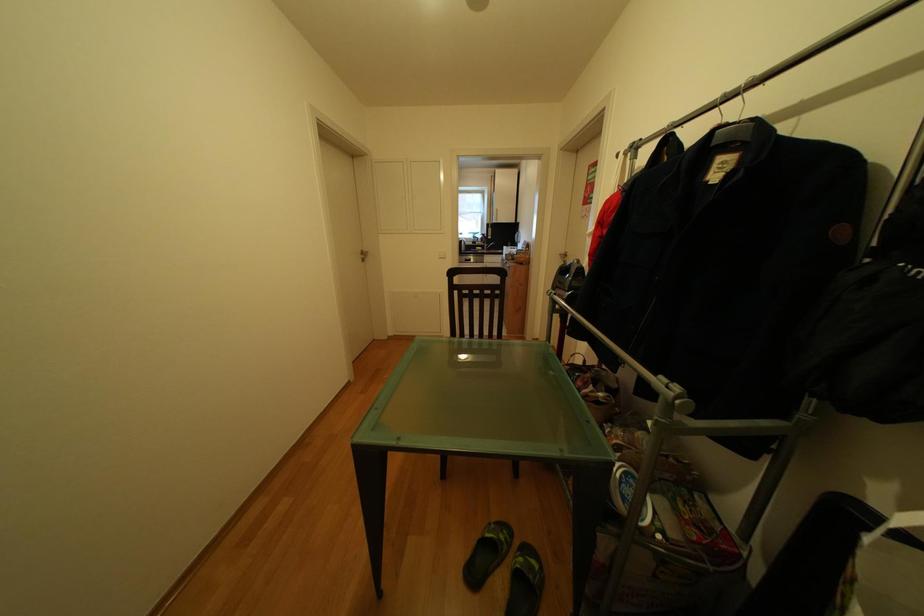
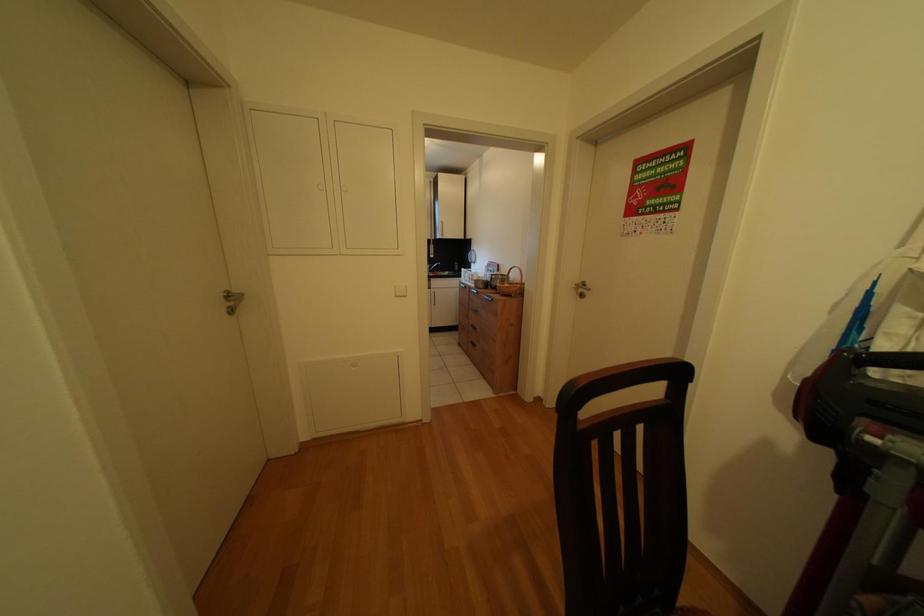
Which direction would the cameraman need to move to produce the second image?

The movement direction of the cameraman is left, forward.